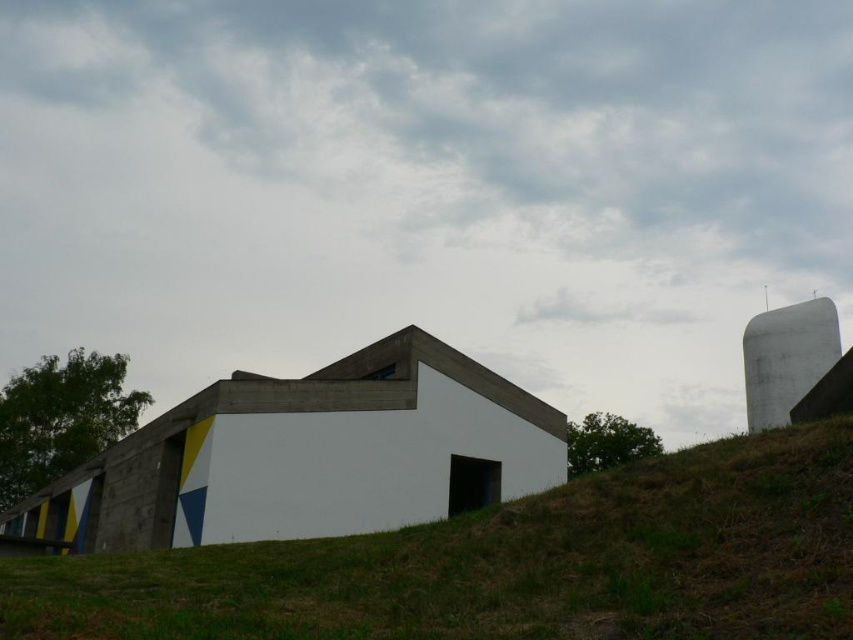
Question: In this image, where is green grassy hillside at lower center located relative to white smooth silo at right?

Choices:
 (A) above
 (B) below

Answer: (B)

Question: Considering the relative positions of green grassy hillside at lower center and white smooth silo at right in the image provided, where is green grassy hillside at lower center located with respect to white smooth silo at right?

Choices:
 (A) above
 (B) below

Answer: (B)

Question: Can you confirm if green grassy hillside at lower center is positioned below white smooth silo at right?

Choices:
 (A) no
 (B) yes

Answer: (B)

Question: Which point is farther to the camera?

Choices:
 (A) (750, 344)
 (B) (241, 577)

Answer: (A)

Question: Among these objects, which one is nearest to the camera?

Choices:
 (A) white smooth silo at right
 (B) green grassy hillside at lower center

Answer: (B)